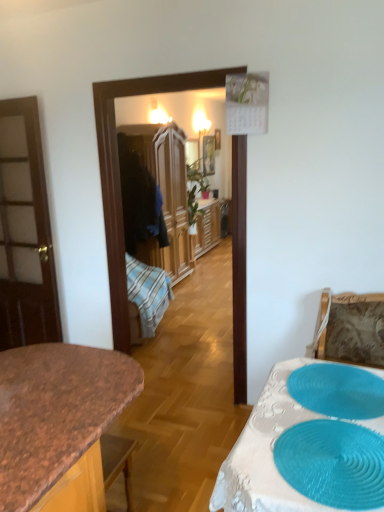
Question: Based on their positions, is teal rubber placemat at lower right, arranged as the 2th oval when viewed from the back, located to the left or right of blue textured placemat at lower right, which ranks as the first oval in back-to-front order?

Choices:
 (A) right
 (B) left

Answer: (B)

Question: Would you say teal rubber placemat at lower right, which appears as the 1th oval when viewed from the front, is inside or outside blue textured placemat at lower right, marked as the 2th oval in a front-to-back arrangement?

Choices:
 (A) outside
 (B) inside

Answer: (A)

Question: Considering the real-world distances, which object is closest to the white lace tablecloth at lower right?

Choices:
 (A) granite countertop at center
 (B) wooden wardrobe at center
 (C) teal rubber placemat at lower right, arranged as the 2th oval when viewed from the back
 (D) wooden picture frame at center
 (E) blue textured placemat at lower right, marked as the 2th oval in a front-to-back arrangement

Answer: (C)

Question: Which is nearer to the blue textured placemat at lower right, which ranks as the first oval in back-to-front order?

Choices:
 (A) white lace tablecloth at lower right
 (B) granite countertop at center
 (C) wooden picture frame at center
 (D) teal rubber placemat at lower right, which appears as the 1th oval when viewed from the front
 (E) wooden wardrobe at center

Answer: (A)